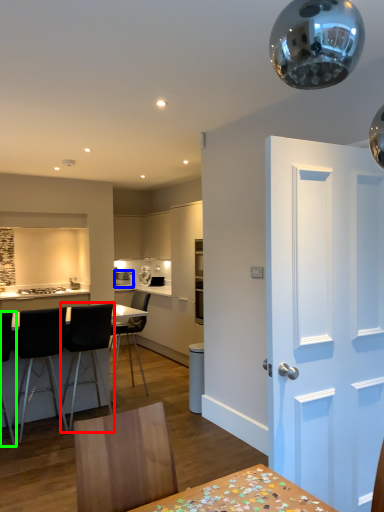
Question: Which object is the farthest from chair (highlighted by a red box)? Choose among these: appliance (highlighted by a blue box) or chair (highlighted by a green box).

Choices:
 (A) appliance
 (B) chair

Answer: (A)